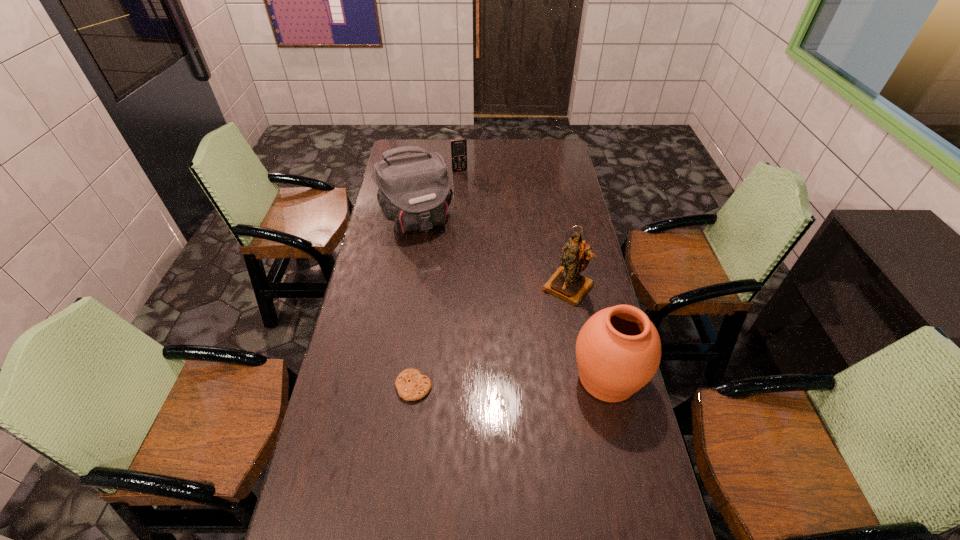
Locate an element on the screen. Image resolution: width=960 pixels, height=540 pixels. figurine that is at the right edge is located at coordinates (566, 283).

Locate an element on the screen. This screenshot has width=960, height=540. vacant space at the far edge of the desktop is located at coordinates (441, 144).

Locate an element on the screen. The image size is (960, 540). blank space at the near edge of the desktop is located at coordinates (565, 512).

This screenshot has height=540, width=960. In the image, there is a desktop. Find the location of `blank space at the left edge`. blank space at the left edge is located at coordinates (388, 329).

Locate an element on the screen. The width and height of the screenshot is (960, 540). vacant area at the right edge is located at coordinates (617, 409).

The image size is (960, 540). In the image, there is a desktop. Find the location of `vacant space at the far left corner`. vacant space at the far left corner is located at coordinates (404, 153).

Locate an element on the screen. Image resolution: width=960 pixels, height=540 pixels. free space between the cellular telephone and the shortest object is located at coordinates (437, 279).

Where is `vacant point located between the urn and the shortest object`? This screenshot has width=960, height=540. vacant point located between the urn and the shortest object is located at coordinates (511, 382).

Where is `free space that is in between the urn and the second farthest object`? free space that is in between the urn and the second farthest object is located at coordinates (512, 299).

You are a GUI agent. You are given a task and a screenshot of the screen. Output one action in this format:
    pyautogui.click(x=<x>, y=<y>)
    Task: Click on the blank region between the urn and the farthest object
    This screenshot has width=960, height=540.
    Given the screenshot: What is the action you would take?
    pyautogui.click(x=534, y=274)